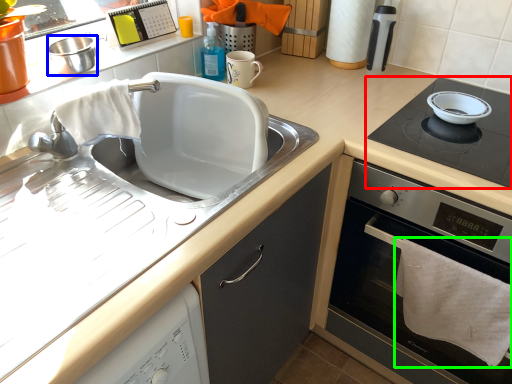
Question: Which object is positioned closest to gas stove (highlighted by a red box)? Select from appliance (highlighted by a blue box) and bath towel (highlighted by a green box).

Choices:
 (A) appliance
 (B) bath towel

Answer: (B)